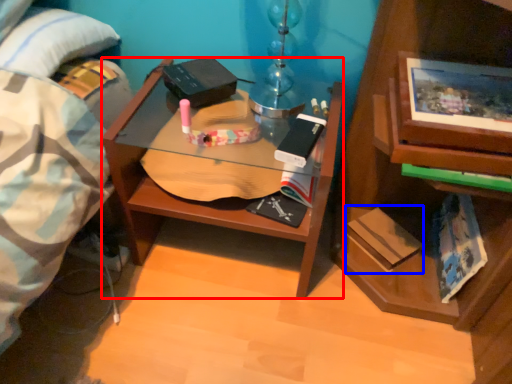
Question: Which object appears closest to the camera in this image, desk (highlighted by a red box) or paperback book (highlighted by a blue box)?

Choices:
 (A) desk
 (B) paperback book

Answer: (A)